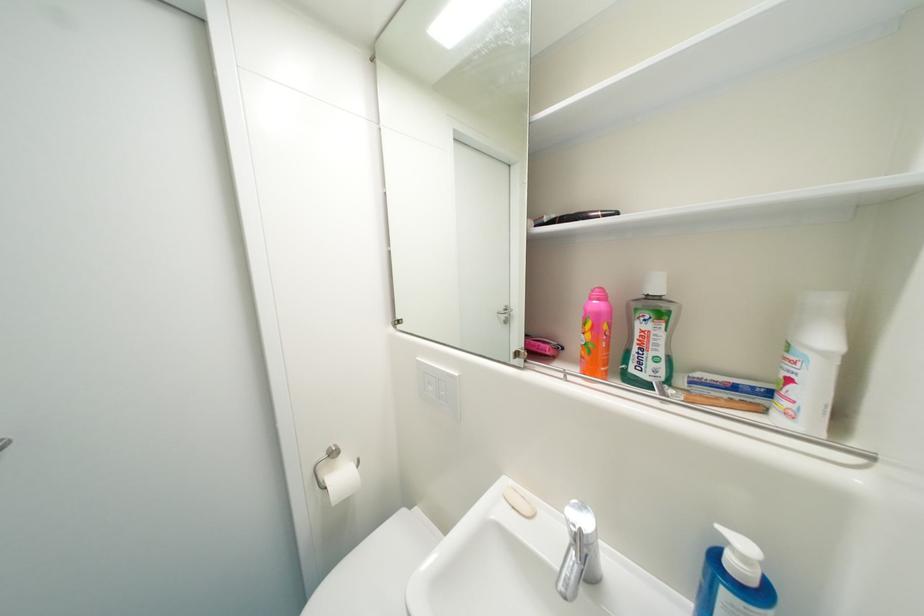
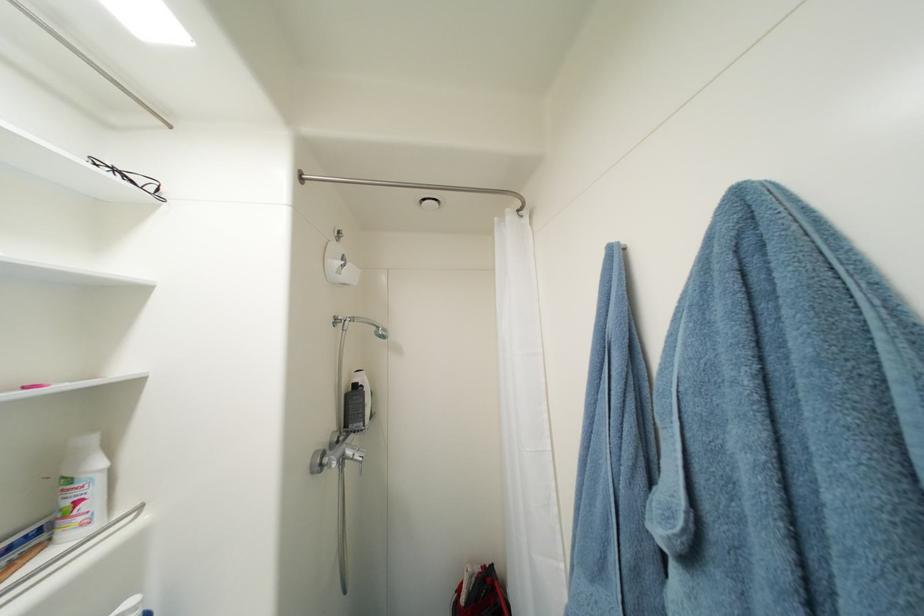
Where in the second image is the point corresponding to [796,382] from the first image?

(84, 504)